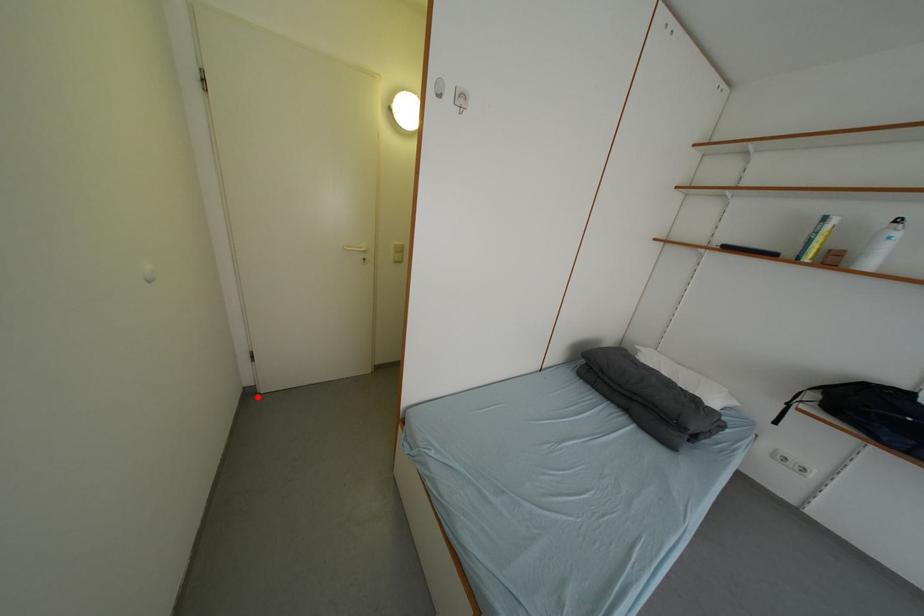
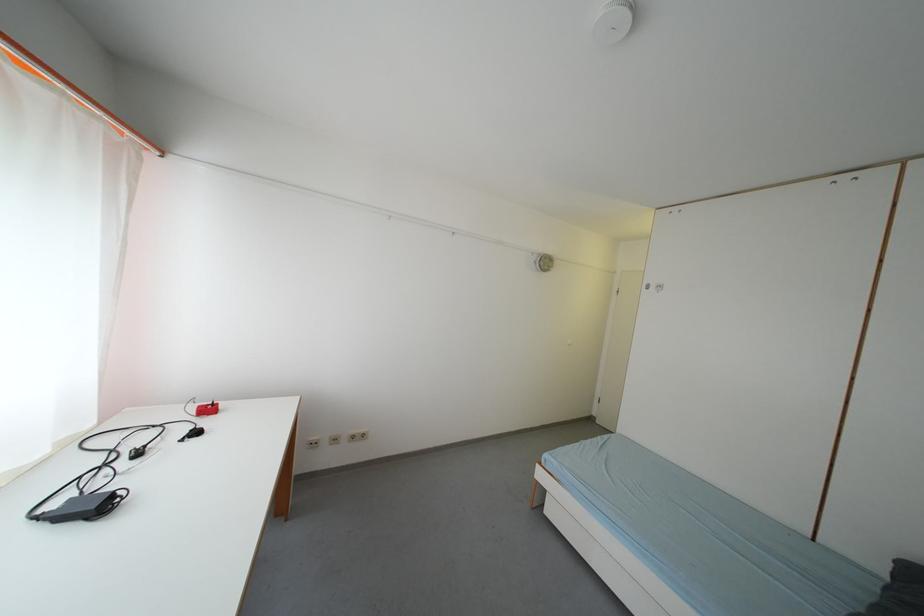
The point at the highlighted location is marked in the first image. Where is the corresponding point in the second image?

(600, 422)